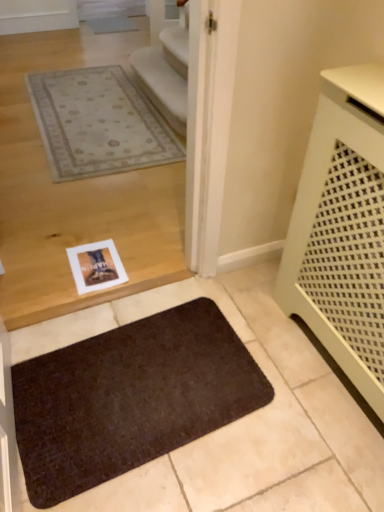
You are a GUI agent. You are given a task and a screenshot of the screen. Output one action in this format:
    pyautogui.click(x=<x>, y=<y>)
    Task: Click on the blank space to the left of white perforated radiator at right
    
    Given the screenshot: What is the action you would take?
    [x=220, y=358]